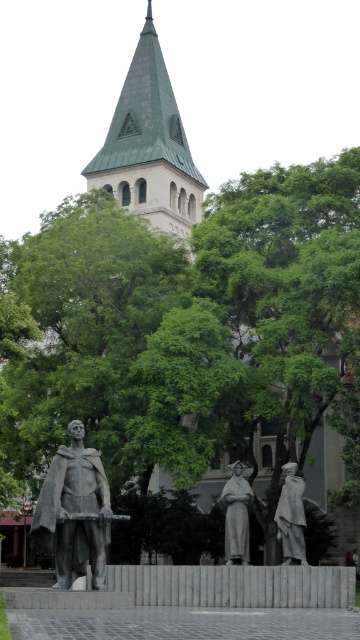
Consider the image. You are an architect analyzing the urban layout. Based on the scene, which object occupies a more prominent position in terms of size between the green metal tower at upper center and the bronze statue at center?

The green metal tower at upper center is larger in size than the bronze statue at center, so it occupies a more prominent position in terms of size.

What is the purpose of the point at coordinates (x=74, y=512) in the image?

The point at coordinates (x=74, y=512) marks the bronze statue at center.